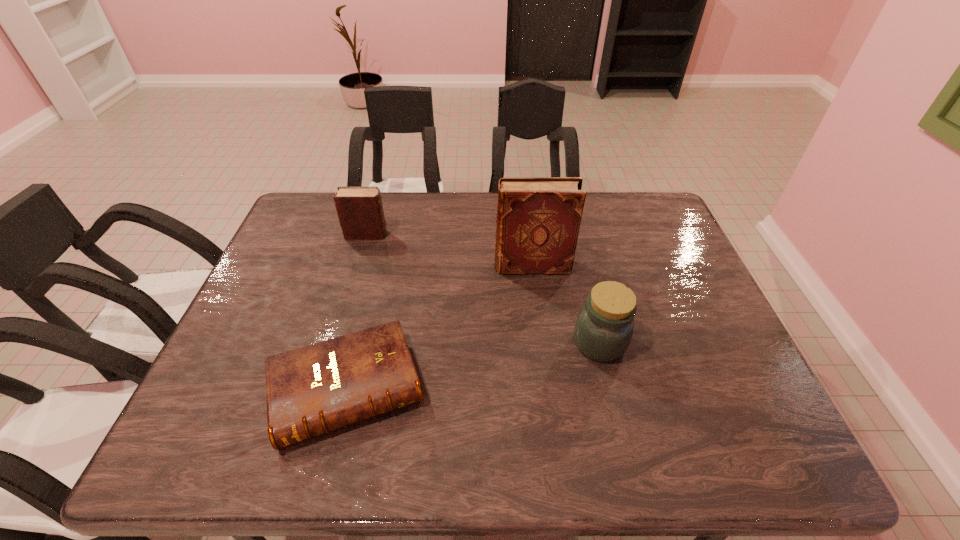
In order to click on the third nearest object in this screenshot , I will do `click(538, 219)`.

Image resolution: width=960 pixels, height=540 pixels. What are the coordinates of `the taller hardback book` in the screenshot? It's located at (538, 219).

I want to click on jar, so click(604, 327).

Image resolution: width=960 pixels, height=540 pixels. Identify the location of the farthest object. (360, 211).

The height and width of the screenshot is (540, 960). I want to click on the left hardback book, so [x=311, y=390].

In order to click on the nearer hardback book in this screenshot , I will do `click(311, 390)`.

Where is `free space located 0.160m on the spine side of the third nearest object`? The width and height of the screenshot is (960, 540). free space located 0.160m on the spine side of the third nearest object is located at coordinates (439, 266).

Where is `free space located on the spine side of the third nearest object`? free space located on the spine side of the third nearest object is located at coordinates (373, 266).

The width and height of the screenshot is (960, 540). In order to click on free space located 0.280m on the spine side of the third nearest object in this screenshot , I will do coord(397,266).

Image resolution: width=960 pixels, height=540 pixels. In order to click on vacant space located on the front of the jar in this screenshot , I will do `click(611, 388)`.